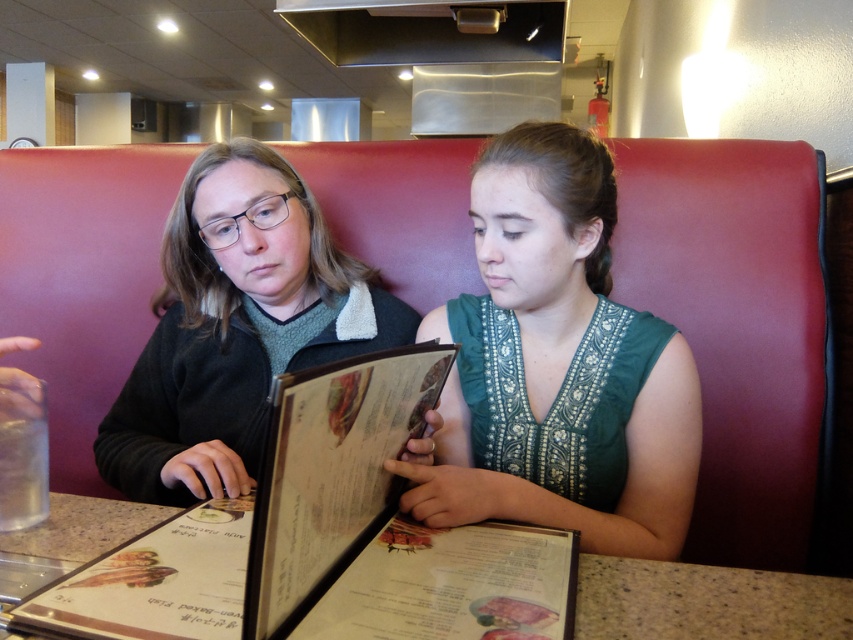
What is the exact coordinate of the green fabric dress at center?

The green fabric dress at center is located at coordinate point [558,365].

You are a waiter standing 30 inches away from the table. You need to place a dessert menu on the table without touching the green fabric dress at center. Is the distance sufficient?

The green fabric dress at center is 27.66 inches away from the viewer. Since you are standing 30 inches away from the table, you can place the dessert menu on the table without touching the green fabric dress at center as there is enough space between you and the dress.

You are a restaurant server who needs to place a 10 cm tall salt shaker on the table between the green fabric dress at center and the black matte menu at center. Which object should you place it closer to to ensure it doesn

The green fabric dress at center is much taller than the black matte menu at center. To ensure the salt shaker is placed closer to the shorter object, you should place it closer to the black matte menu at center.